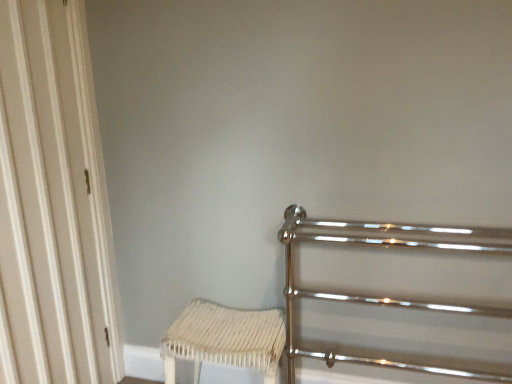
What is the approximate width of white woven stool at lower center?

The width of white woven stool at lower center is 12.53 inches.

Locate an element on the screen. The width and height of the screenshot is (512, 384). white wood door at left is located at coordinates (53, 204).

Looking at this image, considering the positions of objects polished chrome rail at right and white wood door at left in the image provided, who is more to the right, polished chrome rail at right or white wood door at left?

polished chrome rail at right.

From a real-world perspective, is polished chrome rail at right on white wood door at left?

No, from a real-world perspective, polished chrome rail at right is not over white wood door at left

Is polished chrome rail at right further to camera compared to white wood door at left?

Yes, it is behind white wood door at left.

Where is `door located above the polished chrome rail at right (from a real-world perspective)`? Image resolution: width=512 pixels, height=384 pixels. door located above the polished chrome rail at right (from a real-world perspective) is located at coordinates (53, 204).

Which point is more distant from viewer, (476, 245) or (262, 372)?

Point (262, 372)

Is polished chrome rail at right in front of or behind white woven stool at lower center in the image?

polished chrome rail at right is positioned closer to the viewer than white woven stool at lower center.

Is polished chrome rail at right touching white woven stool at lower center?

No, polished chrome rail at right is not in contact with white woven stool at lower center.

Is white woven stool at lower center at the back of polished chrome rail at right?

That's not correct — polished chrome rail at right is not looking away from white woven stool at lower center.

Is white woven stool at lower center further to camera compared to white wood door at left?

Yes, it is.

Is white woven stool at lower center next to white wood door at left and touching it?

white woven stool at lower center and white wood door at left are clearly separated.

From a real-world perspective, is white woven stool at lower center above or below white wood door at left?

In terms of real-world spatial position, white woven stool at lower center is below white wood door at left.

Is white woven stool at lower center shorter than white wood door at left?

Yes, white woven stool at lower center is shorter than white wood door at left.

Is white wood door at left aimed at polished chrome rail at right?

Yes, white wood door at left is turned towards polished chrome rail at right.

Who is taller, white wood door at left or polished chrome rail at right?

With more height is white wood door at left.

Looking at this image, is the position of white wood door at left less distant than that of polished chrome rail at right?

Yes, the depth of white wood door at left is less than that of polished chrome rail at right.

Where is `door above the polished chrome rail at right (from the image's perspective)`? The image size is (512, 384). door above the polished chrome rail at right (from the image's perspective) is located at coordinates (53, 204).

Is point (262, 340) more distant than point (495, 229)?

That is True.

From a real-world perspective, which is physically above, white woven stool at lower center or polished chrome rail at right?

polished chrome rail at right.

Is white woven stool at lower center oriented towards polished chrome rail at right?

No, white woven stool at lower center is not aimed at polished chrome rail at right.

Is polished chrome rail at right inside white woven stool at lower center?

Actually, polished chrome rail at right is outside white woven stool at lower center.

Is white wood door at left turned away from white woven stool at lower center?

No, white wood door at left is not facing away from white woven stool at lower center.

From the image's perspective, which one is positioned lower, white wood door at left or white woven stool at lower center?

white woven stool at lower center.

Is white wood door at left in front of or behind white woven stool at lower center in the image?

white wood door at left is positioned closer to the viewer than white woven stool at lower center.

Locate an element on the screen. This screenshot has height=384, width=512. rail below the white wood door at left (from the image's perspective) is located at coordinates (386, 297).

Locate an element on the screen. Image resolution: width=512 pixels, height=384 pixels. rail above the white woven stool at lower center (from the image's perspective) is located at coordinates (386, 297).

From the image, which object appears to be farther from polished chrome rail at right, white wood door at left or white woven stool at lower center?

white wood door at left is positioned further to the anchor polished chrome rail at right.

Which object lies further to the anchor point white woven stool at lower center, polished chrome rail at right or white wood door at left?

Among the two, white wood door at left is located further to white woven stool at lower center.

Based on their spatial positions, is polished chrome rail at right or white woven stool at lower center further from white wood door at left?

Based on the image, polished chrome rail at right appears to be further to white wood door at left.

Estimate the real-world distances between objects in this image. Which object is further from polished chrome rail at right, white woven stool at lower center or white wood door at left?

The object further to polished chrome rail at right is white wood door at left.

Considering their positions, is white woven stool at lower center positioned further to white wood door at left than polished chrome rail at right?

polished chrome rail at right is further to white wood door at left.

Based on their spatial positions, is white wood door at left or polished chrome rail at right closer to white woven stool at lower center?

polished chrome rail at right lies closer to white woven stool at lower center than the other object.

Where is `furniture located between white wood door at left and polished chrome rail at right in the left-right direction`? This screenshot has width=512, height=384. furniture located between white wood door at left and polished chrome rail at right in the left-right direction is located at coordinates (225, 339).